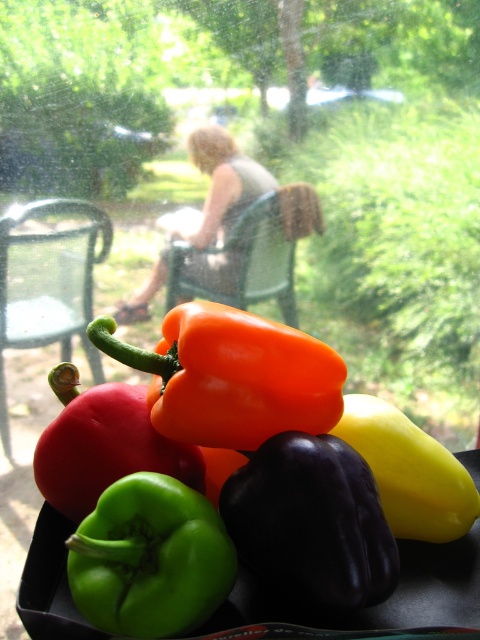
You are a chef preparing a dish and need to choose between the orange glossy bell pepper at center and the blonde hair at center. Which one is larger?

The orange glossy bell pepper at center is bigger than the blonde hair at center, so you should choose the orange glossy bell pepper at center for your dish.

You are holding a 16 inch ruler and want to measure the distance from your eyes to the point marked at coordinates point [237,442] in the image. Based on the scene description, can your ruler reach that distance?

The distance between point [237,442] and the camera is 17.88 inches. Since your ruler is only 16 inches long, it cannot reach the full distance to the point [237,442].

You are arranging vegetables on a table and notice an orange glossy bell pepper at center and a green matte bell pepper at lower left. Which pepper is positioned to the right of the other?

The orange glossy bell pepper at center is to the right of the green matte bell pepper at lower left.